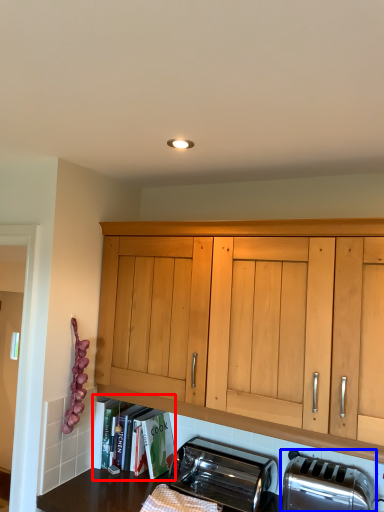
Question: Which point is closer to the camera, shelf (highlighted by a red box) or toaster (highlighted by a blue box)?

Choices:
 (A) shelf
 (B) toaster

Answer: (B)